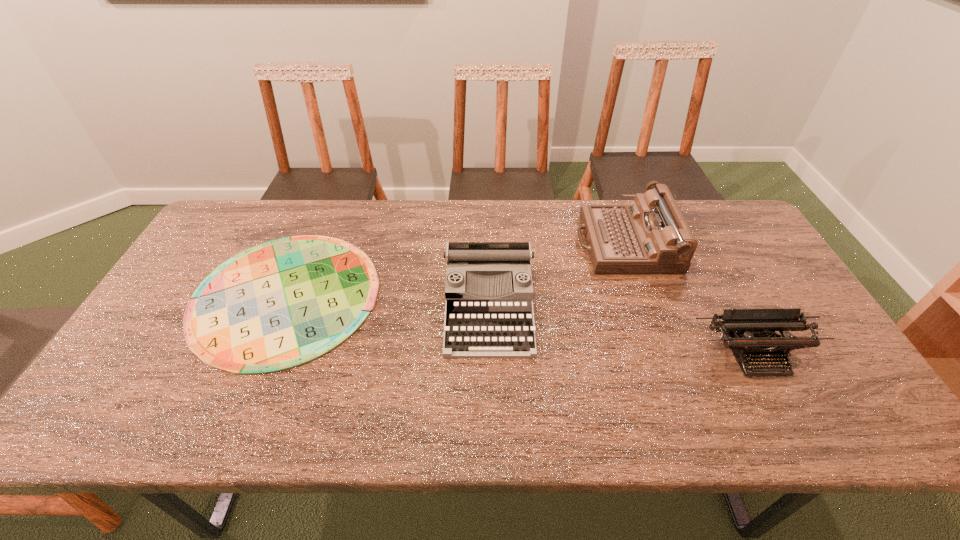
Identify the location of vacant region between the leftmost object and the second object from left to right. (387, 301).

You are a GUI agent. You are given a task and a screenshot of the screen. Output one action in this format:
    pyautogui.click(x=<x>, y=<y>)
    Task: Click on the vacant area between the tallest typewriter and the leftmost typewriter
    
    Given the screenshot: What is the action you would take?
    pos(557,275)

Where is `free space between the third object from right to left and the shortest object`? free space between the third object from right to left and the shortest object is located at coordinates pyautogui.click(x=387, y=301).

This screenshot has height=540, width=960. Identify the location of the third closest object relative to the leftmost typewriter. (750, 333).

Locate which object ranks third in proximity to the tallest object. Please provide its 2D coordinates. Your answer should be formatted as a tuple, i.e. [(x, y)], where the tuple contains the x and y coordinates of a point satisfying the conditions above.

[(283, 303)]

The height and width of the screenshot is (540, 960). In order to click on typewriter that is the second closest to the third object from right to left in this screenshot , I will do `click(750, 333)`.

Find the location of `typewriter that stands as the second closest to the second object from left to right`. typewriter that stands as the second closest to the second object from left to right is located at coordinates (750, 333).

Find the location of a particular element. Image resolution: width=960 pixels, height=540 pixels. blank area in the image that satisfies the following two spatial constraints: 1. on the keyboard of the tallest typewriter; 2. on the typing side of the third object from right to left is located at coordinates (647, 307).

This screenshot has height=540, width=960. I want to click on vacant space that satisfies the following two spatial constraints: 1. on the keyboard of the tallest typewriter; 2. on the typing side of the third object from right to left, so click(x=647, y=307).

In order to click on vacant space that satisfies the following two spatial constraints: 1. on the keyboard of the tallest object; 2. on the front side of the gameboard in this screenshot , I will do `click(643, 295)`.